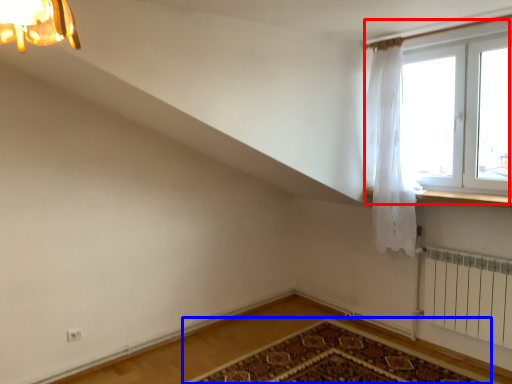
Question: Which of the following is the farthest to the observer, window (highlighted by a red box) or mat (highlighted by a blue box)?

Choices:
 (A) window
 (B) mat

Answer: (A)